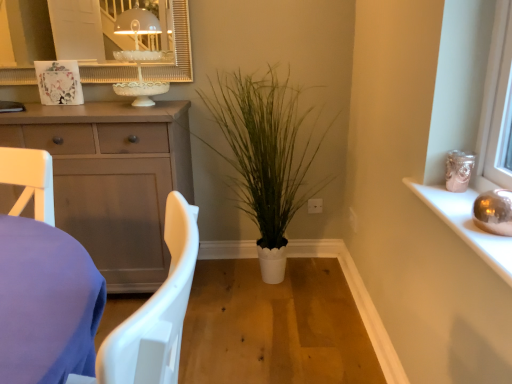
Question: Relative to matte gray cabinet at left, is metallic silver sphere at upper right in front or behind?

Choices:
 (A) front
 (B) behind

Answer: (A)

Question: From the image's perspective, is metallic silver sphere at upper right above or below matte gray cabinet at left?

Choices:
 (A) above
 (B) below

Answer: (B)

Question: Which of these objects is positioned farthest from the white matte plant at center?

Choices:
 (A) metallic silver sphere at upper right
 (B) matte gray cabinet at left
 (C) white porcelain candle holder at upper center
 (D) white plastic chair at lower left
 (E) white textured mirror at upper center

Answer: (D)

Question: Which is nearer to the white matte plant at center?

Choices:
 (A) white porcelain candle holder at upper center
 (B) white plastic chair at lower left
 (C) white textured mirror at upper center
 (D) metallic silver sphere at upper right
 (E) matte gray cabinet at left

Answer: (E)